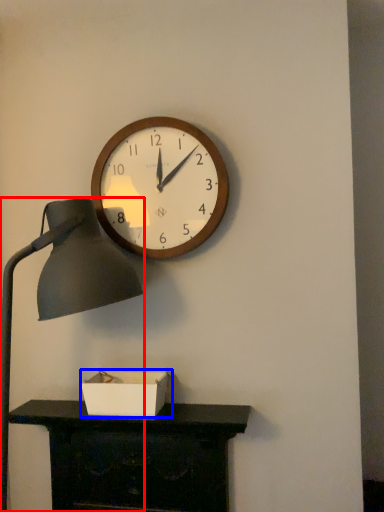
Question: Which object is further to the camera taking this photo, lamp (highlighted by a red box) or box (highlighted by a blue box)?

Choices:
 (A) lamp
 (B) box

Answer: (B)